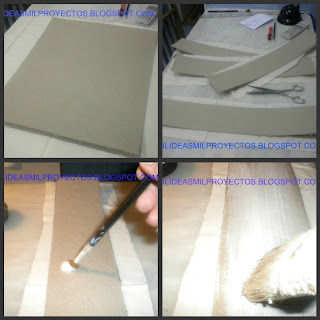
Find the location of a particular element. This screenshot has height=320, width=320. white table is located at coordinates (21, 39).